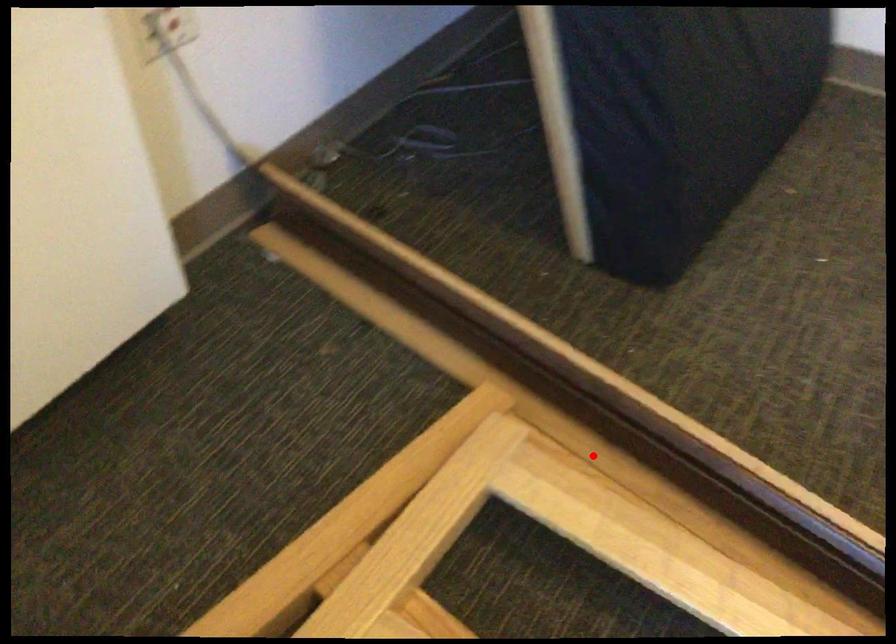
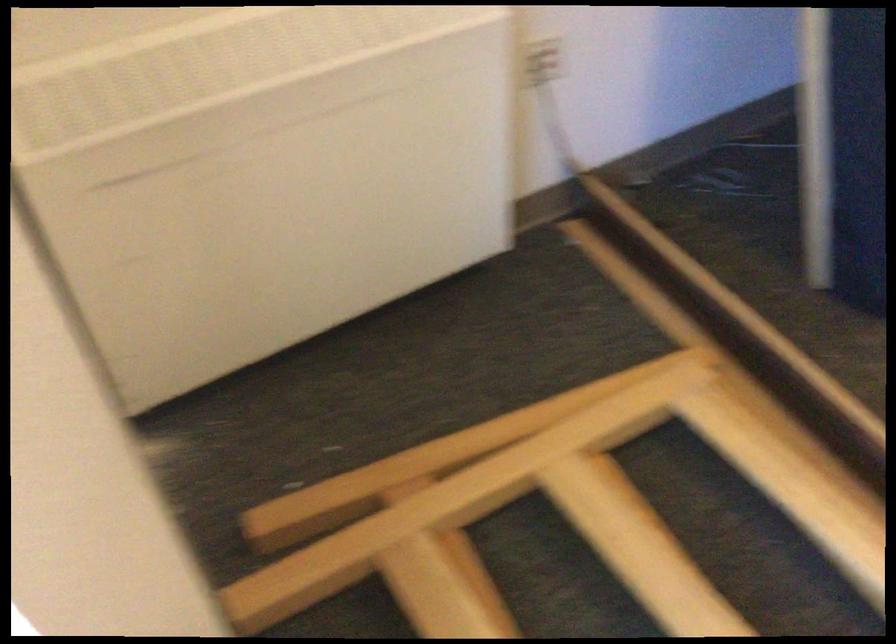
Question: A red point is marked in image1. In image2, is the corresponding 3D point closer to the camera or farther? Reply with the corresponding letter.

Choices:
 (A) The corresponding 3D point is closer.
 (B) The corresponding 3D point is farther.

Answer: (B)